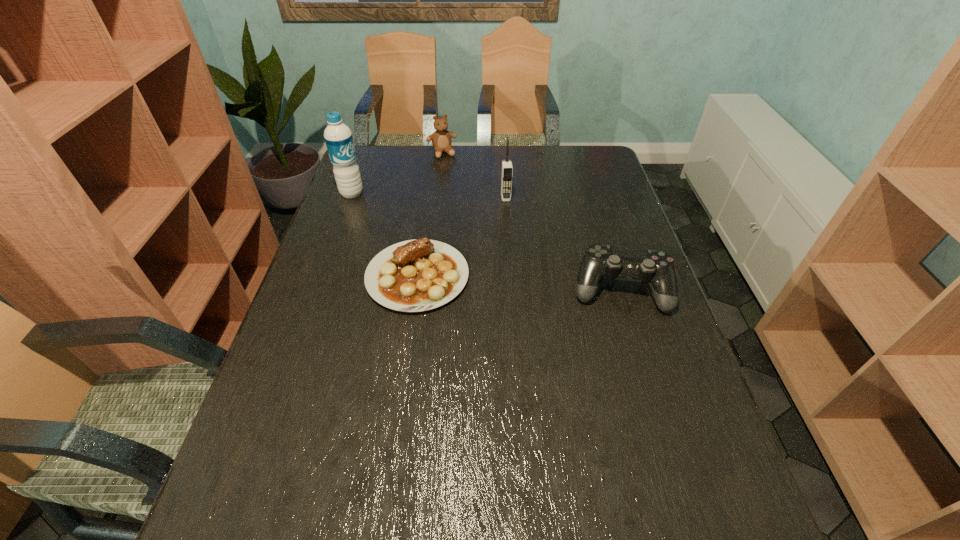
Where is `vacant area located 0.210m on the left of the rightmost object`? The image size is (960, 540). vacant area located 0.210m on the left of the rightmost object is located at coordinates (492, 289).

Where is `vacant space situated 0.320m on the label of the leftmost object`? The height and width of the screenshot is (540, 960). vacant space situated 0.320m on the label of the leftmost object is located at coordinates (428, 239).

Identify the location of blank space located 0.270m on the label of the leftmost object. (417, 232).

You are a GUI agent. You are given a task and a screenshot of the screen. Output one action in this format:
    pyautogui.click(x=<x>, y=<y>)
    Task: Click on the vacant position located on the label of the leftmost object
    This screenshot has width=960, height=540.
    Given the screenshot: What is the action you would take?
    click(386, 214)

The width and height of the screenshot is (960, 540). Identify the location of vacant space located on the front-facing side of the third tallest object. click(468, 208).

Where is `free location located 0.200m on the front-facing side of the third tallest object`? The width and height of the screenshot is (960, 540). free location located 0.200m on the front-facing side of the third tallest object is located at coordinates (459, 189).

This screenshot has width=960, height=540. Find the location of `vacant space situated on the front-facing side of the third tallest object`. vacant space situated on the front-facing side of the third tallest object is located at coordinates (450, 169).

This screenshot has width=960, height=540. I want to click on vacant space located 0.380m on the front-facing side of the fourth object from left to right, so click(520, 286).

Where is `free space located 0.390m on the front-facing side of the fourth object from left to right`? This screenshot has height=540, width=960. free space located 0.390m on the front-facing side of the fourth object from left to right is located at coordinates (520, 289).

At what (x,y) coordinates should I click in order to perform the action: click on free region located on the front-facing side of the fourth object from left to right. Please return your answer as a coordinate pair (x, y). Looking at the image, I should click on (520, 289).